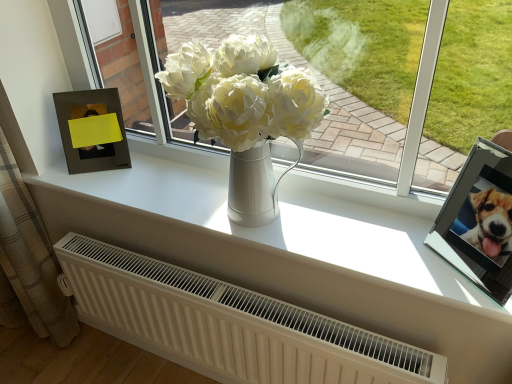
Question: From the image's perspective, would you say metallic silver picture frame at upper right, which is the 1th picture frame from front to back, is shown under plaid fabric curtain at left?

Choices:
 (A) yes
 (B) no

Answer: (B)

Question: Is metallic silver picture frame at upper right, the 1th picture frame in the right-to-left sequence, at the right side of plaid fabric curtain at left?

Choices:
 (A) yes
 (B) no

Answer: (A)

Question: Is metallic silver picture frame at upper right, the 1th picture frame in the right-to-left sequence, behind plaid fabric curtain at left?

Choices:
 (A) yes
 (B) no

Answer: (B)

Question: Can you confirm if metallic silver picture frame at upper right, the 1th picture frame in the right-to-left sequence, is bigger than plaid fabric curtain at left?

Choices:
 (A) no
 (B) yes

Answer: (A)

Question: From a real-world perspective, does metallic silver picture frame at upper right, the 2th picture frame when ordered from left to right, stand above plaid fabric curtain at left?

Choices:
 (A) yes
 (B) no

Answer: (A)

Question: From a real-world perspective, is matte brown picture frame at left, the 1th picture frame viewed from the back, above or below white matte vase at center?

Choices:
 (A) below
 (B) above

Answer: (B)

Question: From the image's perspective, is matte brown picture frame at left, acting as the 1th picture frame starting from the left, located above or below white matte vase at center?

Choices:
 (A) below
 (B) above

Answer: (B)

Question: Considering the positions of matte brown picture frame at left, the 1th picture frame viewed from the back, and white matte vase at center in the image, is matte brown picture frame at left, the 1th picture frame viewed from the back, taller or shorter than white matte vase at center?

Choices:
 (A) tall
 (B) short

Answer: (A)

Question: Considering the positions of point (106, 109) and point (375, 226), is point (106, 109) closer or farther from the camera than point (375, 226)?

Choices:
 (A) closer
 (B) farther

Answer: (B)

Question: From a real-world perspective, is white matte radiator at lower center positioned above or below white matte vase at center?

Choices:
 (A) above
 (B) below

Answer: (B)

Question: From their relative heights in the image, would you say white matte radiator at lower center is taller or shorter than white matte vase at center?

Choices:
 (A) short
 (B) tall

Answer: (A)

Question: Looking at the image, does white matte radiator at lower center seem bigger or smaller compared to white matte vase at center?

Choices:
 (A) big
 (B) small

Answer: (A)

Question: Would you say white matte radiator at lower center is to the left or to the right of white matte vase at center in the picture?

Choices:
 (A) left
 (B) right

Answer: (A)

Question: From a real-world perspective, is white matte vase at center positioned above or below matte brown picture frame at left, which is the second picture frame in front-to-back order?

Choices:
 (A) below
 (B) above

Answer: (A)

Question: Is white matte vase at center in front of or behind matte brown picture frame at left, which is the second picture frame in front-to-back order, in the image?

Choices:
 (A) behind
 (B) front

Answer: (B)